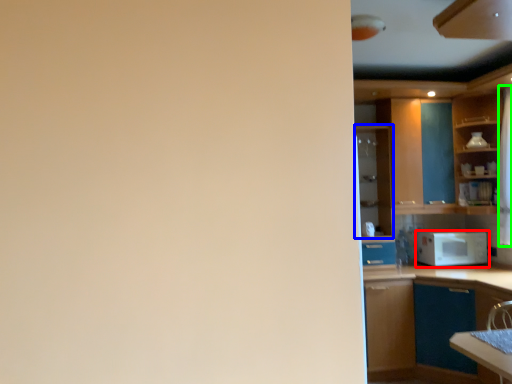
Question: Which object is the closest to the microwave oven (highlighted by a red box)? Choose among these: cabinetry (highlighted by a blue box) or curtain (highlighted by a green box).

Choices:
 (A) cabinetry
 (B) curtain

Answer: (B)